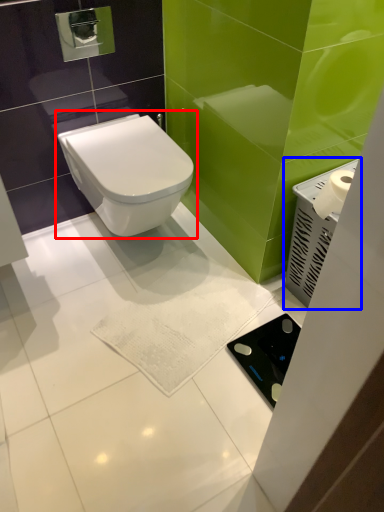
Question: Which object appears farthest to the camera in this image, toilet (highlighted by a red box) or appliance (highlighted by a blue box)?

Choices:
 (A) toilet
 (B) appliance

Answer: (A)